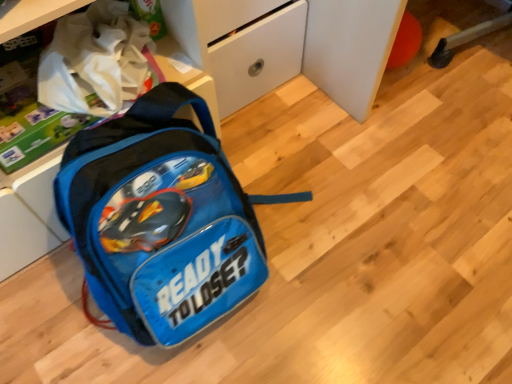
Question: Is blue fabric backpack at center taller or shorter than white matte drawer at center?

Choices:
 (A) short
 (B) tall

Answer: (A)

Question: Based on their sizes in the image, would you say blue fabric backpack at center is bigger or smaller than white matte drawer at center?

Choices:
 (A) big
 (B) small

Answer: (A)

Question: Looking at their shapes, would you say blue fabric backpack at center is wider or thinner than white matte drawer at center?

Choices:
 (A) thin
 (B) wide

Answer: (B)

Question: Considering the positions of white matte drawer at center and blue fabric backpack at center in the image, is white matte drawer at center wider or thinner than blue fabric backpack at center?

Choices:
 (A) wide
 (B) thin

Answer: (B)

Question: Is point (224, 77) closer or farther from the camera than point (134, 198)?

Choices:
 (A) closer
 (B) farther

Answer: (B)

Question: Looking at the image, does white matte drawer at center seem bigger or smaller compared to blue fabric backpack at center?

Choices:
 (A) big
 (B) small

Answer: (B)

Question: Considering their positions, is white matte drawer at center located in front of or behind blue fabric backpack at center?

Choices:
 (A) front
 (B) behind

Answer: (B)